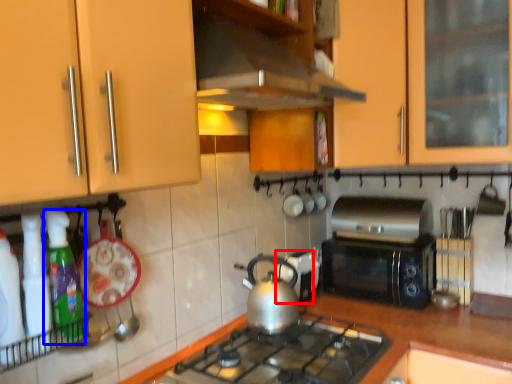
Question: Which of the following is the closest to the observer, appliance (highlighted by a red box) or kitchen appliance (highlighted by a blue box)?

Choices:
 (A) appliance
 (B) kitchen appliance

Answer: (B)